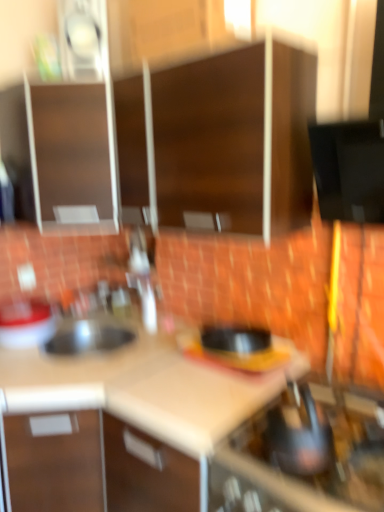
Question: Considering the positions of matte white sink at left and beige laminate counter top at center, marked as the 1th counter top in a right-to-left arrangement, in the image, is matte white sink at left wider or thinner than beige laminate counter top at center, marked as the 1th counter top in a right-to-left arrangement,?

Choices:
 (A) wide
 (B) thin

Answer: (B)

Question: Based on their positions, is matte white sink at left located to the left or right of beige laminate counter top at center, which appears as the 2th counter top when viewed from the left?

Choices:
 (A) right
 (B) left

Answer: (B)

Question: Which object is positioned closest to the white matte countertop at center, which appears as the second counter top when viewed from the right?

Choices:
 (A) matte brown cabinet at upper left, the 1th cabinetry when ordered from left to right
 (B) wooden cabinet at center, which is the third cabinetry from left to right
 (C) beige laminate counter top at center, which appears as the 2th counter top when viewed from the left
 (D) matte white sink at left
 (E) metallic silver kettle at lower right

Answer: (D)

Question: Estimate the real-world distances between objects in this image. Which object is closer to the metallic silver kettle at lower right?

Choices:
 (A) wooden cabinet at center, arranged as the first cabinetry when viewed from the right
 (B) matte white sink at left
 (C) matte brown cabinet at upper left, which appears as the third cabinetry when viewed from the right
 (D) white matte countertop at center, which appears as the second counter top when viewed from the right
 (E) beige laminate countertop at center

Answer: (E)